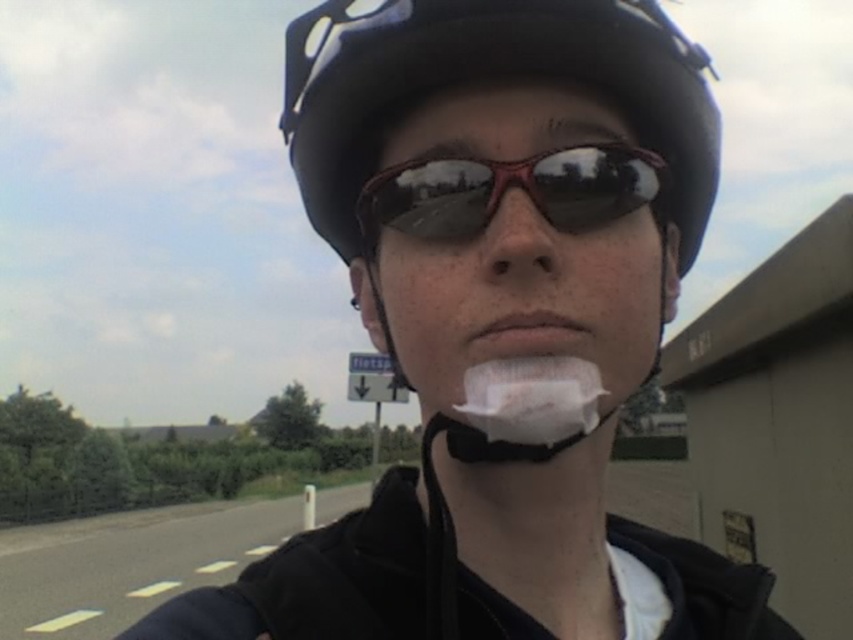
Looking at this image, you are a photographer taking a portrait of the person in the image. You notice the white matte shaving cream at center and the matte skin nose at center. Which object should you adjust to ensure the subject looks natural in the photo?

The white matte shaving cream at center is to the right of the matte skin nose at center. To make the subject look natural, you should adjust the white matte shaving cream at center so it is not positioned unnaturally to the right of the matte skin nose at center.

You are a delivery person who needs to handwrite a note to a customer. You see the white matte shaving cream at center. Can you reach it from your current position?

The white matte shaving cream at center is 14.06 inches away from viewer, so yes, you can reach it from your current position since it is within arm reach.

In the scene shown: You are a photographer trying to capture a portrait of the person wearing the matte black helmet at center and the matte skin nose at center. Since you want to focus on the facial features, which object should you adjust your camera to focus on, considering their sizes?

The matte black helmet at center has a greater height compared to the matte skin nose at center, so you should focus on the matte skin nose at center to emphasize the facial features since it is smaller and more detailed.